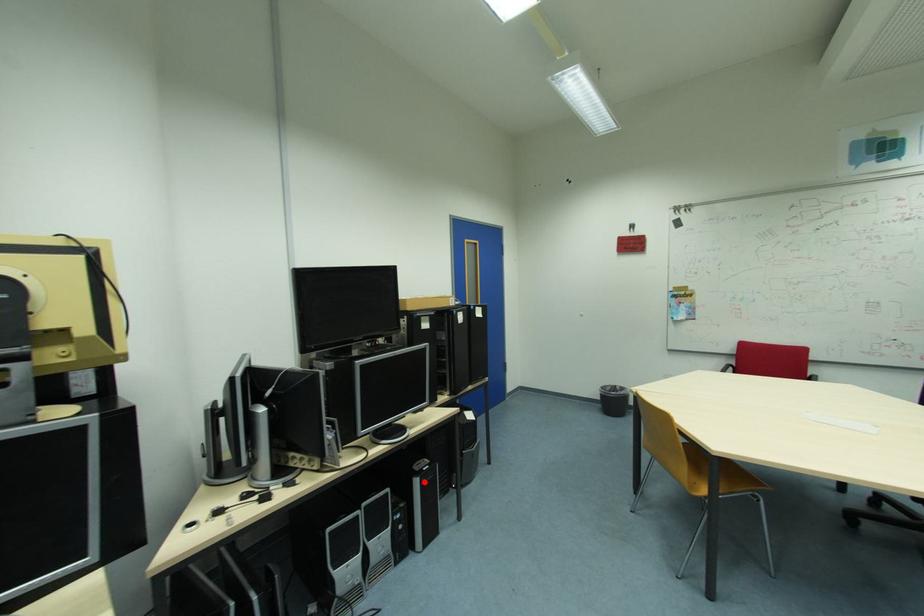
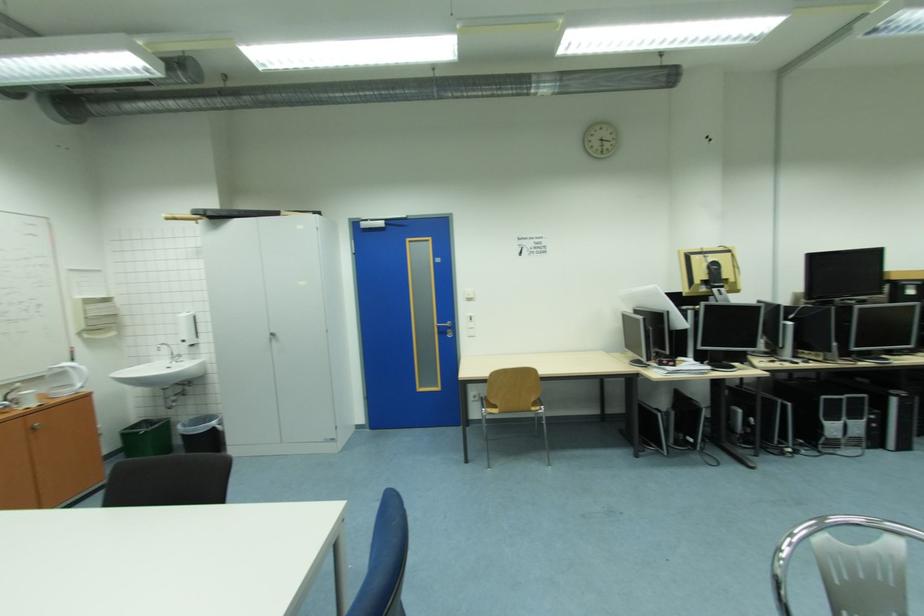
Question: I am providing you with two images of the same scene from different viewpoints. In image1, a red point is highlighted. Considering the same 3D point in image2, which of the following is correct?

Choices:
 (A) It is closer
 (B) It is farther

Answer: (A)